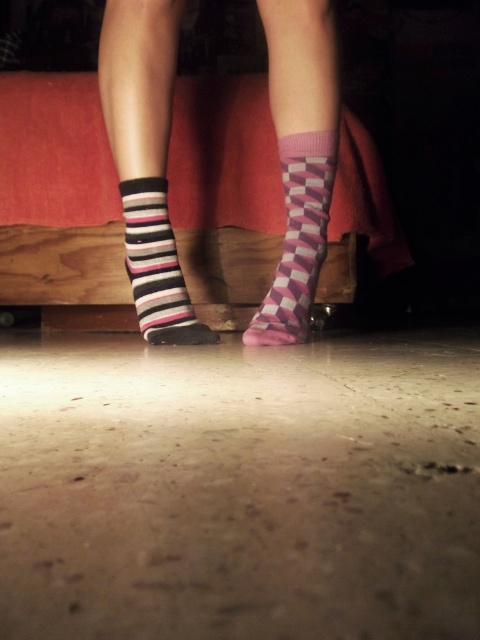
Question: Based on their relative distances, which object is nearer to the striped cotton sock at left?

Choices:
 (A) striped cotton socks at lower left
 (B) pink checkered sock at center

Answer: (A)

Question: Is striped cotton sock at left below pink diamond-patterned socks at lower center?

Choices:
 (A) no
 (B) yes

Answer: (A)

Question: Which is farther from the matte black shoe at center?

Choices:
 (A) striped cotton socks at lower left
 (B) pink checkered sock at center
 (C) striped socks at center
 (D) pink diamond-patterned socks at lower center

Answer: (C)

Question: Can you confirm if striped socks at center is positioned to the right of matte black shoe at center?

Choices:
 (A) no
 (B) yes

Answer: (B)

Question: Which object is farther from the camera taking this photo?

Choices:
 (A) striped cotton socks at lower left
 (B) pink checkered sock at center
 (C) pink diamond-patterned socks at lower center
 (D) striped socks at center

Answer: (B)

Question: Is striped cotton socks at lower left positioned before matte black shoe at center?

Choices:
 (A) no
 (B) yes

Answer: (B)